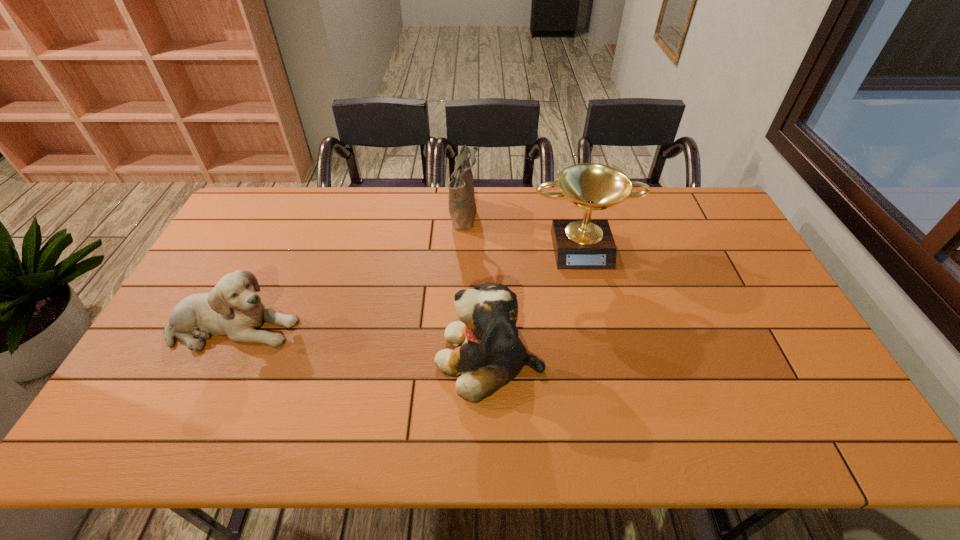
Identify the location of unoccupied position between the shoulder bag and the rightmost object. The width and height of the screenshot is (960, 540). (523, 228).

The width and height of the screenshot is (960, 540). Identify the location of free spot between the shortest object and the taller puppy. (362, 343).

Locate an element on the screen. Image resolution: width=960 pixels, height=540 pixels. free space between the shoulder bag and the left puppy is located at coordinates (348, 269).

Identify the location of free area in between the award and the shoulder bag. The width and height of the screenshot is (960, 540). (523, 228).

Find the location of a particular element. The height and width of the screenshot is (540, 960). vacant space that's between the left puppy and the taller puppy is located at coordinates (362, 343).

Where is `unoccupied position between the shoulder bag and the rightmost object`? The width and height of the screenshot is (960, 540). unoccupied position between the shoulder bag and the rightmost object is located at coordinates (523, 228).

Locate an element on the screen. The height and width of the screenshot is (540, 960). unoccupied area between the rightmost object and the leftmost object is located at coordinates (408, 286).

You are a GUI agent. You are given a task and a screenshot of the screen. Output one action in this format:
    pyautogui.click(x=<x>, y=<y>)
    Task: Click on the free space that is in between the right puppy and the shortest object
    The height and width of the screenshot is (540, 960).
    Given the screenshot: What is the action you would take?
    pyautogui.click(x=362, y=343)

Find the location of a particular element. unoccupied area between the shoulder bag and the rightmost object is located at coordinates (523, 228).

Find the location of `vacant space that is in between the right puppy and the shoulder bag`. vacant space that is in between the right puppy and the shoulder bag is located at coordinates (477, 285).